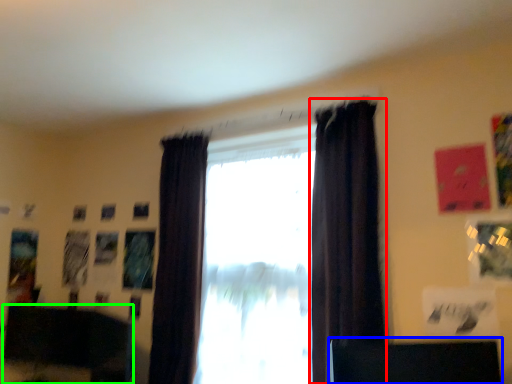
Question: Based on their relative distances, which object is farther from curtain (highlighted by a red box)? Choose from furniture (highlighted by a blue box) and furniture (highlighted by a green box).

Choices:
 (A) furniture
 (B) furniture

Answer: (B)